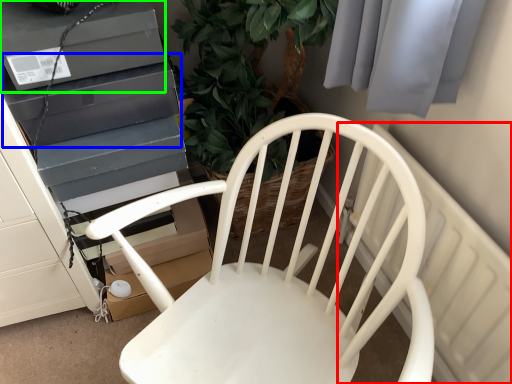
Question: Considering the real-world distances, which object is closest to radiator (highlighted by a red box)? appliance (highlighted by a blue box) or appliance (highlighted by a green box).

Choices:
 (A) appliance
 (B) appliance

Answer: (A)